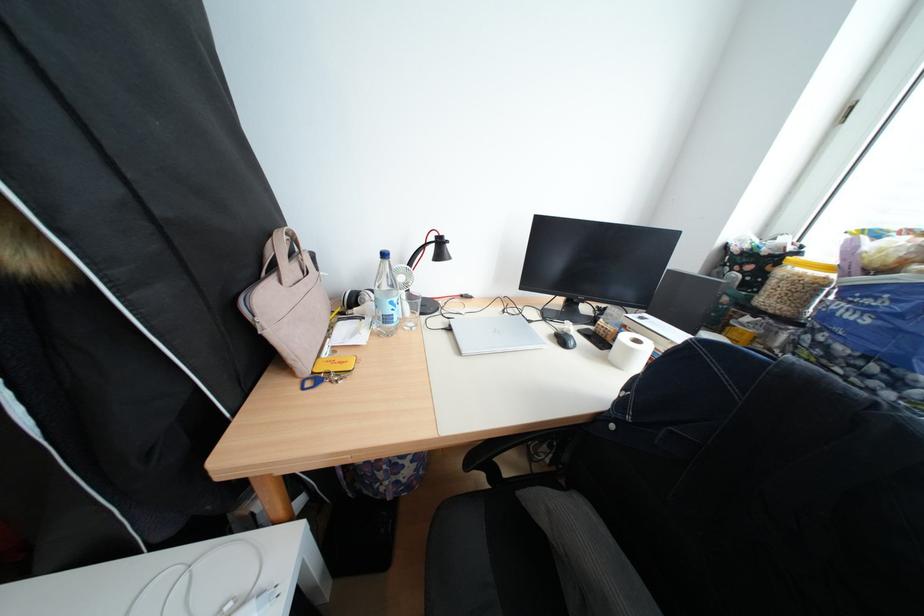
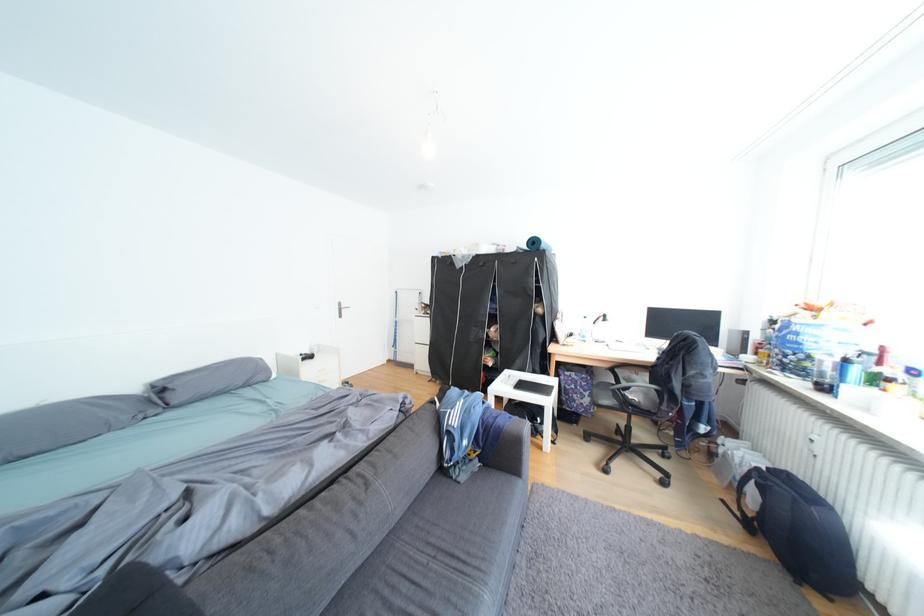
Find the pixel in the second image that matches the point at 380,309 in the first image.

(590, 337)